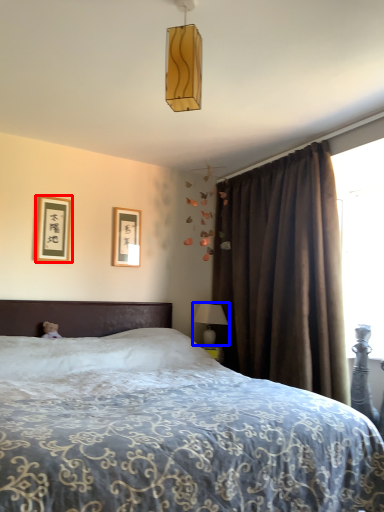
Question: Which object is closer to the camera taking this photo, picture frame (highlighted by a red box) or table lamp (highlighted by a blue box)?

Choices:
 (A) picture frame
 (B) table lamp

Answer: (A)